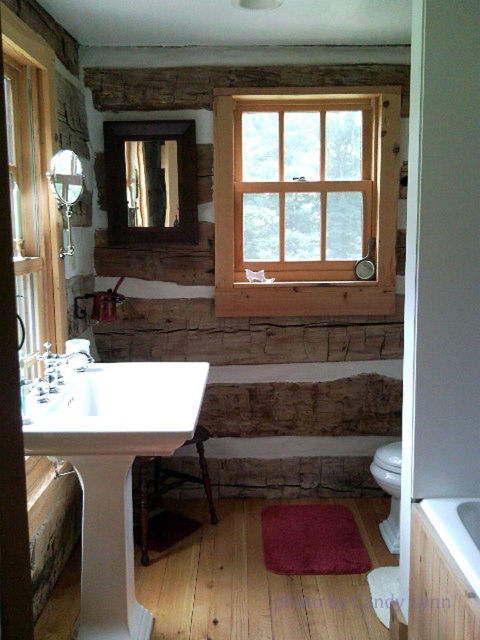
You are planning to install a new floor lamp in the bathroom. The lamp requires a 1.2 meter clearance on its right side. Given the placement of the white glossy sink at center and the white glossy porcelain toilet bowl at lower right, is there enough space between them to place the lamp?

The white glossy sink at center is to the left of the white glossy porcelain toilet bowl at lower right, so there is sufficient space between them to place the lamp with the required 1.2 meter clearance on its right side.

You are standing in the bathroom and want to clean the wooden frame at center. Which direction should you move the cleaning cloth to reach it from the brushed metal faucet at left?

The wooden frame at center is located above the brushed metal faucet at left, so you should move the cleaning cloth upward from the brushed metal faucet at left to reach it.

You are a plumber inspecting the bathroom layout. You need to access the brushed metal faucet at left to fix a leak. However, the white glossy bathtub at lower right is blocking your path. Can you move around the bathtub to reach the faucet?

The white glossy bathtub at lower right is in front of the brushed metal faucet at left, meaning the bathtub is blocking the direct path. To access the faucet, you would need to move around the sides of the bathtub to reach the faucet from the left or behind.